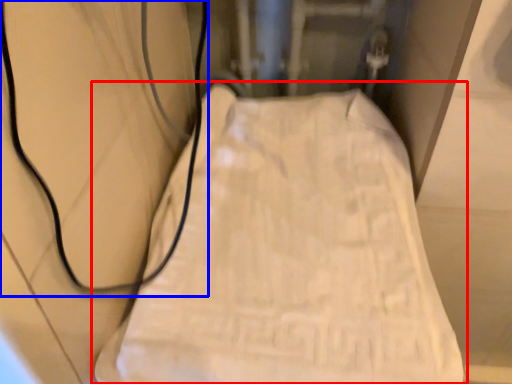
Question: Among these objects, which one is nearest to the camera, furniture (highlighted by a red box) or wire (highlighted by a blue box)?

Choices:
 (A) furniture
 (B) wire

Answer: (B)